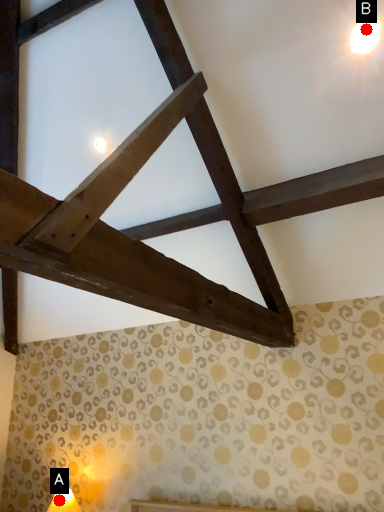
Question: Two points are circled on the image, labeled by A and B beside each circle. Which point is further to the camera?

Choices:
 (A) A is further
 (B) B is further

Answer: (A)